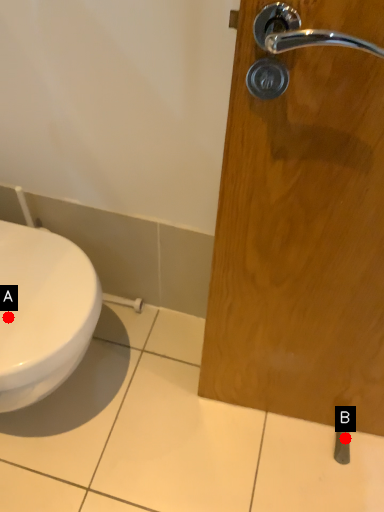
Question: Two points are circled on the image, labeled by A and B beside each circle. Which point is farther to the camera?

Choices:
 (A) A is further
 (B) B is further

Answer: (B)